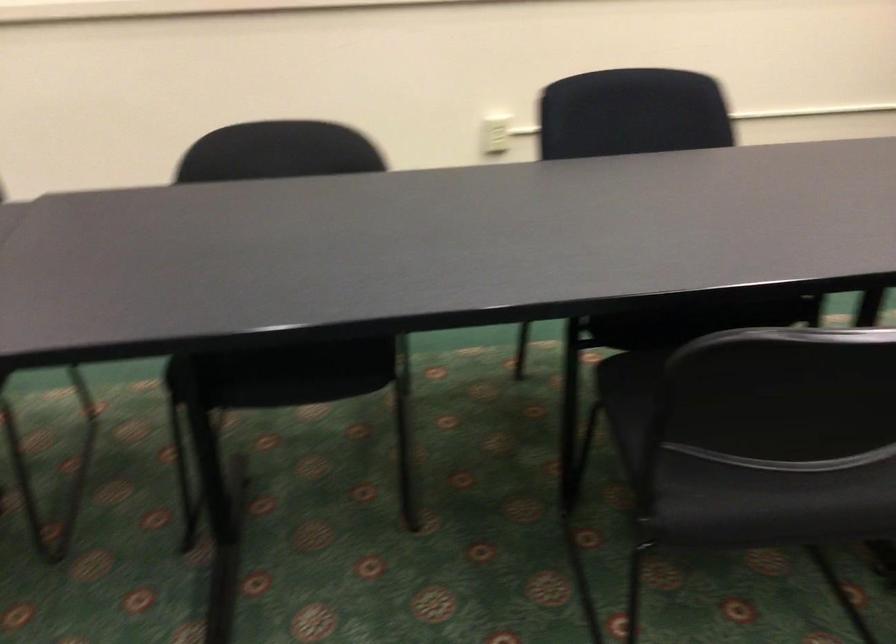
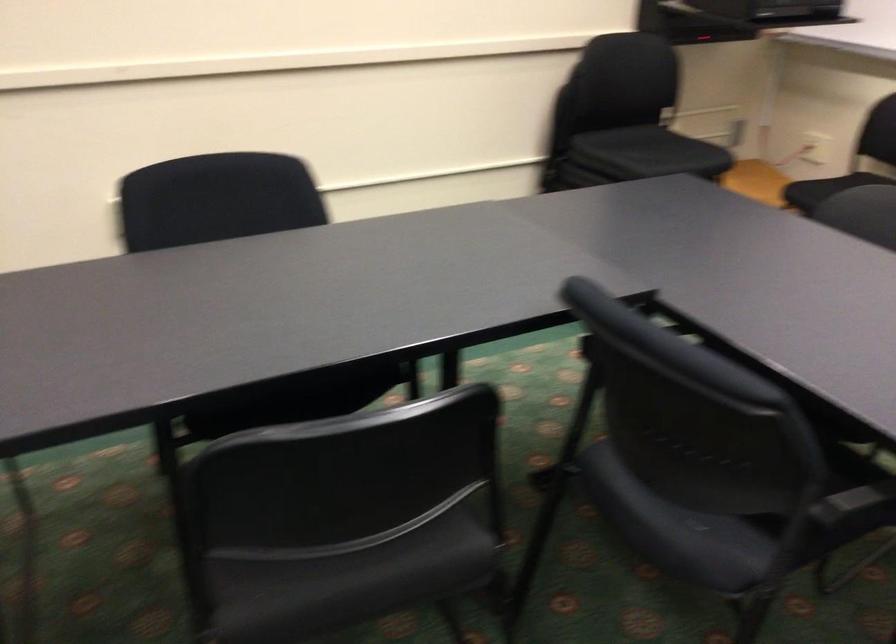
Locate, in the second image, the point that corresponds to (x=807, y=493) in the first image.

(371, 569)